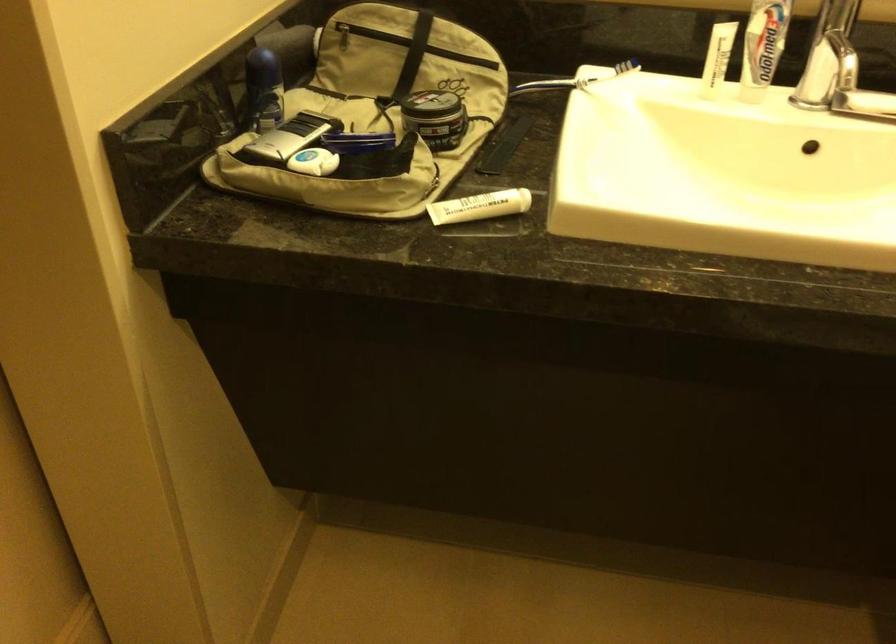
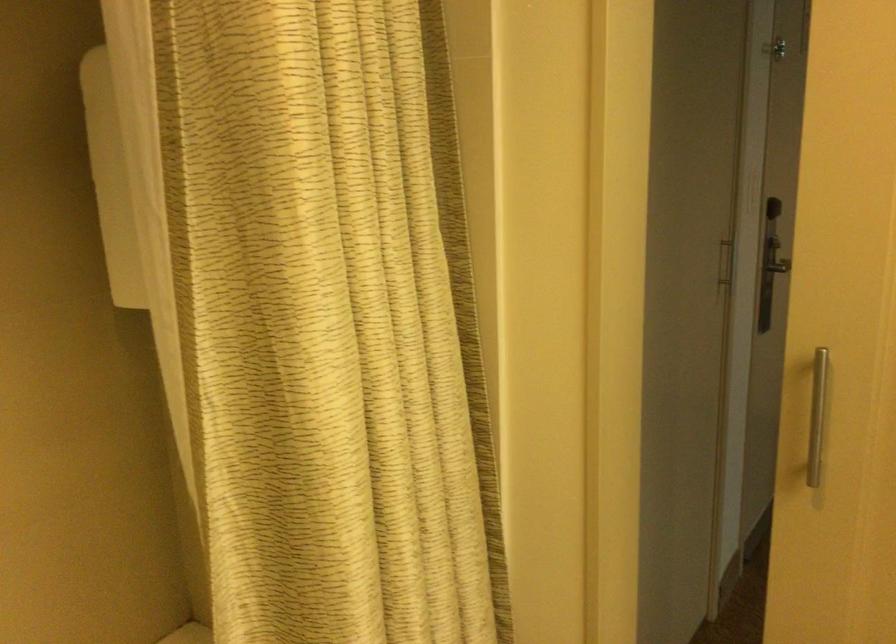
How did the camera likely rotate?

The rotation direction of the camera is left-down.